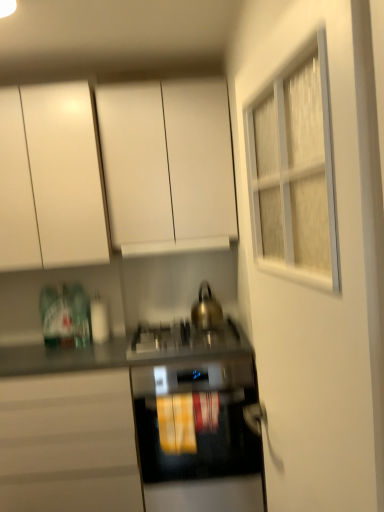
This screenshot has height=512, width=384. What are the coordinates of `free region under gold metallic kettle at center (from a real-world perspective)` in the screenshot? It's located at (210, 318).